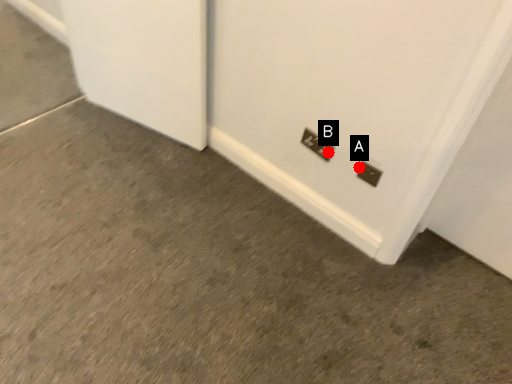
Question: Two points are circled on the image, labeled by A and B beside each circle. Which point is further to the camera?

Choices:
 (A) A is further
 (B) B is further

Answer: (B)